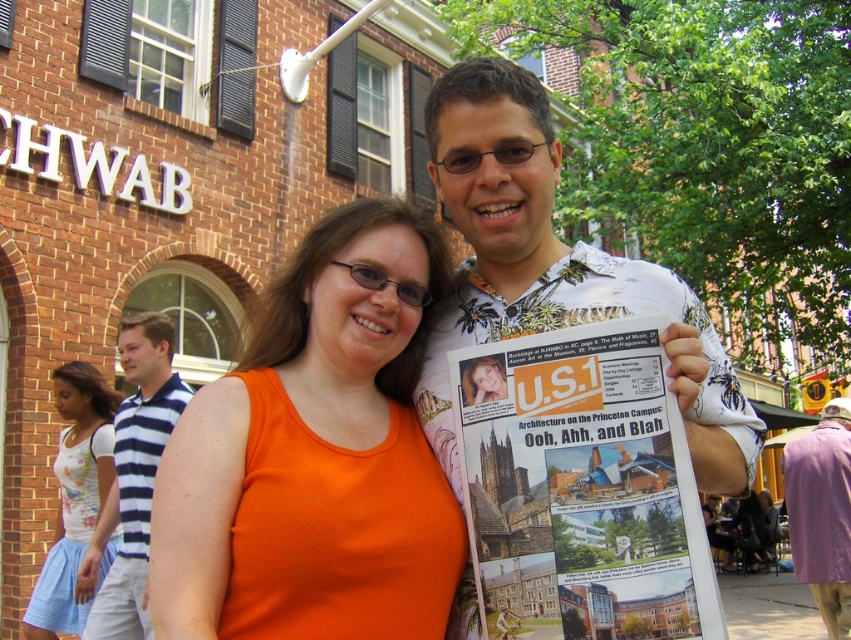
You are a photographer standing between the two people in the scene. You want to take a photo that includes both the orange sleeveless top and the white floral shirt at center. Given their distance apart, will you need to zoom out your camera lens to fit both in the frame?

The two people are 38.12 feet apart. To capture both the orange sleeveless top and the white floral shirt at center in a single frame, you would need to zoom out your camera lens to accommodate their distance apart.

You are a fashion designer observing the scene and want to create a new line based on the clothing items. Since you need to know which item is narrower to design accordingly, can you tell me which clothing item is narrower between the white floral fabric dress at lower left and the purple fabric coat at lower right?

The white floral fabric dress at lower left is narrower than the purple fabric coat at lower right because its width is less than the coat.